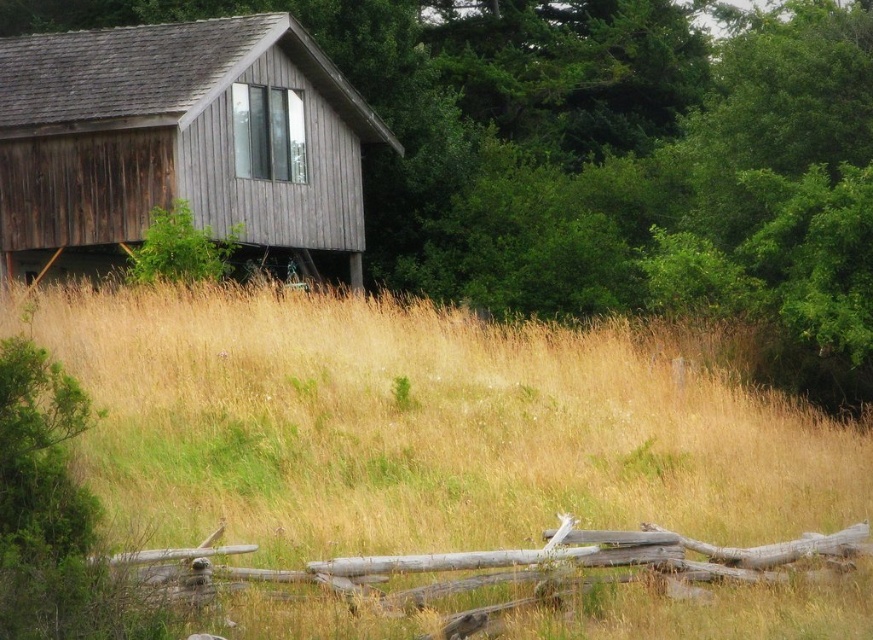
You are standing in front of the weathered wood cabin at upper left and want to walk towards the green leafy tree at upper center. Which direction should you head?

You should head to the right to reach the green leafy tree at upper center since it is located to the right of the weathered wood cabin at upper left.

You are standing in front of the rustic wooden cabin and want to know which object is taller between the dry grass at center and the green leafy tree at upper center. Can you determine which one is taller?

The green leafy tree at upper center is taller than the dry grass at center.

You are standing in front of the rustic wooden cabin and notice a green leafy tree at upper center. Based on its position, can you determine if the tree is closer to the cabin or further away from it?

The green leafy tree at upper center is located at point 0.247 on the x and 0.696 on the y axis, which places it in the upper center area of the image. Since the cabin is situated in the lower part of the image and the tree is positioned higher up, it is further away from the cabin.